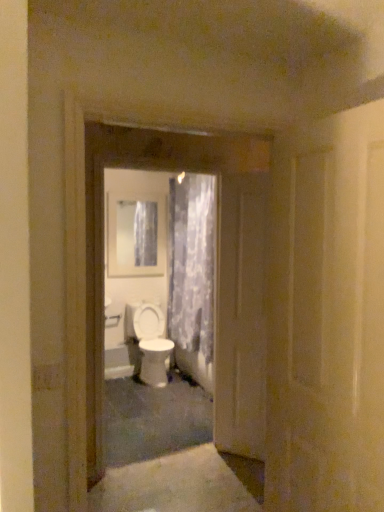
Question: Is point (87, 431) closer or farther from the camera than point (347, 330)?

Choices:
 (A) closer
 (B) farther

Answer: (B)

Question: From the image's perspective, relative to white glossy door at center, placed as the first door when sorted from front to back, is white glossy door at center, which is the 2th door in front-to-back order, above or below?

Choices:
 (A) above
 (B) below

Answer: (B)

Question: Based on their relative distances, which object is nearer to the white glossy door at center, which is the first door in back-to-front order?

Choices:
 (A) white glossy medicine cabinet at upper center
 (B) translucent floral fabric at center
 (C) white glossy door at center, arranged as the second door when viewed from the back
 (D) white glossy door at center, placed as the first door when sorted from front to back
 (E) white glossy toilet at center

Answer: (C)

Question: Which object is positioned closest to the white glossy medicine cabinet at upper center?

Choices:
 (A) translucent floral fabric at center
 (B) white glossy door at center, which is the third door from back to front
 (C) white glossy toilet at center
 (D) white glossy door at center, positioned as the 3th door in front-to-back order
 (E) white glossy door at center, which is the 2th door in front-to-back order

Answer: (A)